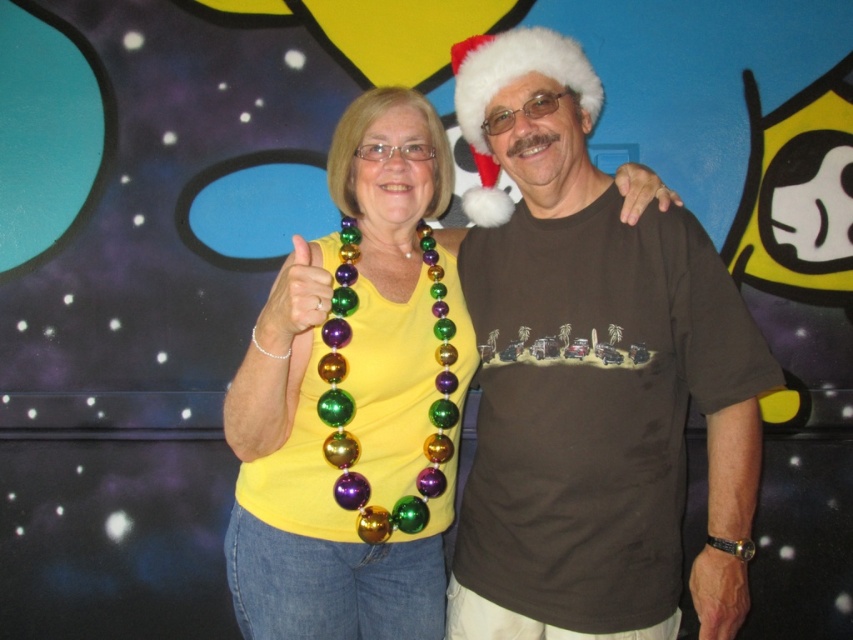
You are an astronaut navigating through a space station and need to move from point A to point B. You see two points marked as point (537,573) and point (416,280) in the image. Which point is closer to you when facing the direction of the backdrop?

Point (537,573) is in front of point (416,280), so it is closer to you when facing the backdrop direction.

You are standing in front of the image and want to know how far the point at coordinates point [670,211] is from you. Can you determine the distance?

The point at coordinates point [670,211] is 4.76 feet away from you.